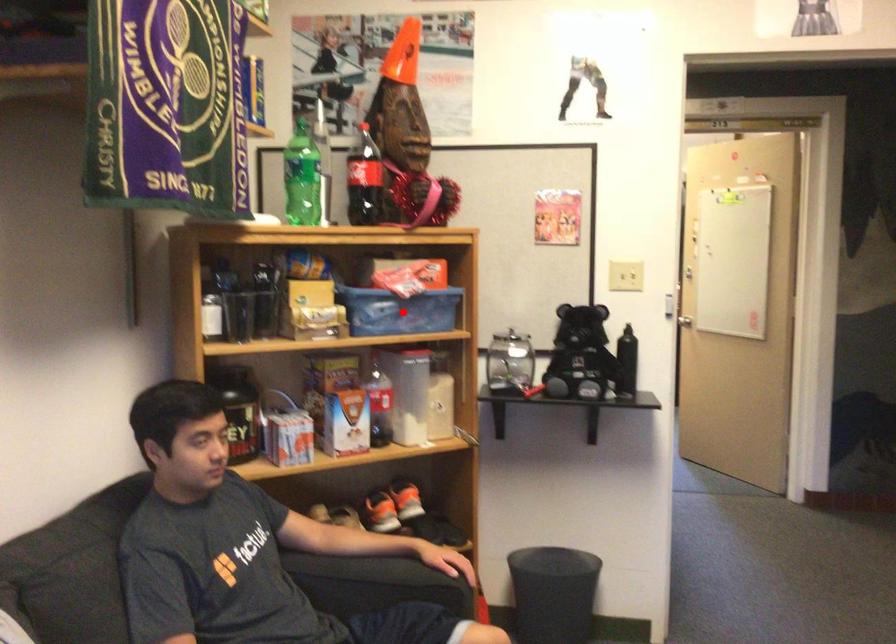
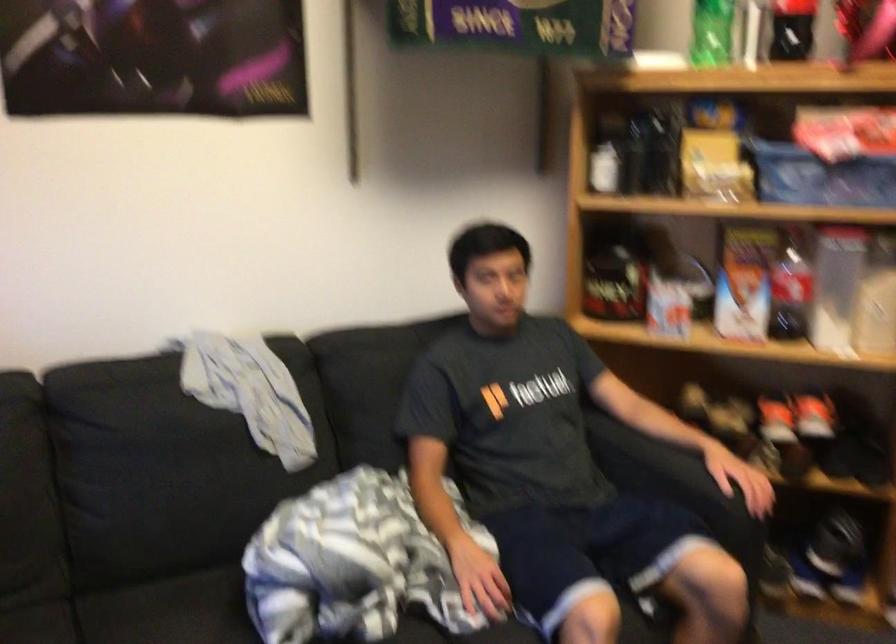
Find the pixel in the second image that matches the highlighted location in the first image.

(820, 176)